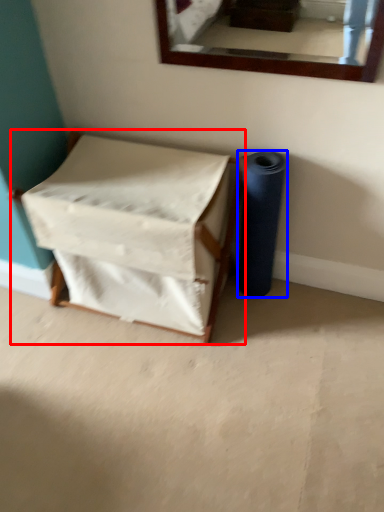
Question: Which object appears farthest to the camera in this image, furniture (highlighted by a red box) or toilet paper (highlighted by a blue box)?

Choices:
 (A) furniture
 (B) toilet paper

Answer: (B)